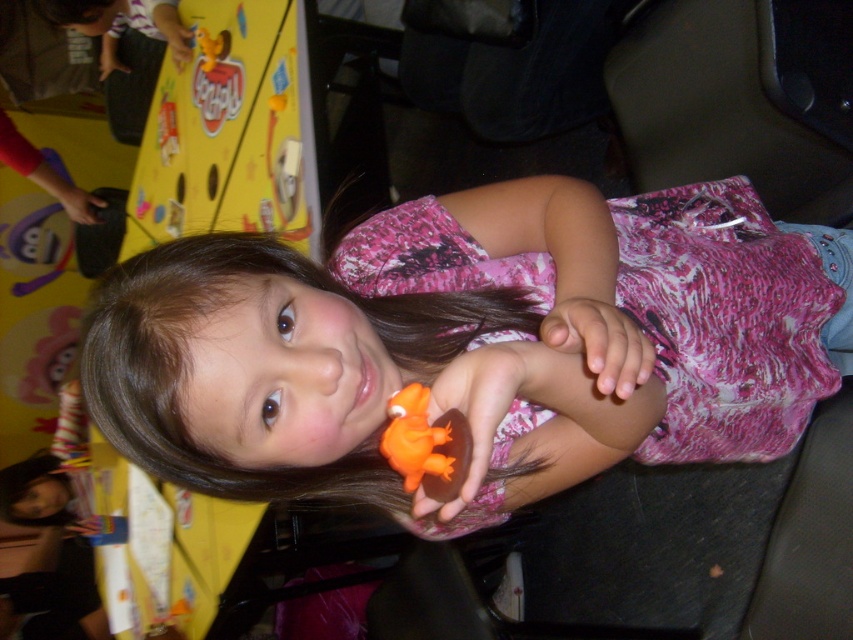
Question: Can you confirm if orange rubber duck at center is thinner than pink matte hand at center?

Choices:
 (A) yes
 (B) no

Answer: (B)

Question: Estimate the real-world distances between objects in this image. Which object is closer to the matte orange toy at center?

Choices:
 (A) matte black hand at upper left
 (B) pink matte hand at center
 (C) orange rubber toy at center

Answer: (B)

Question: Which point is closer to the camera?

Choices:
 (A) (404, 397)
 (B) (171, 468)
 (C) (582, 305)

Answer: (A)

Question: Is pink matte hand at center behind matte black hand at upper left?

Choices:
 (A) yes
 (B) no

Answer: (B)

Question: Can you confirm if orange rubber duck at center is positioned to the right of pink matte hand at center?

Choices:
 (A) no
 (B) yes

Answer: (A)

Question: Among these objects, which one is farthest from the camera?

Choices:
 (A) orange rubber toy at center
 (B) pink matte hand at center
 (C) matte black hand at upper left

Answer: (C)